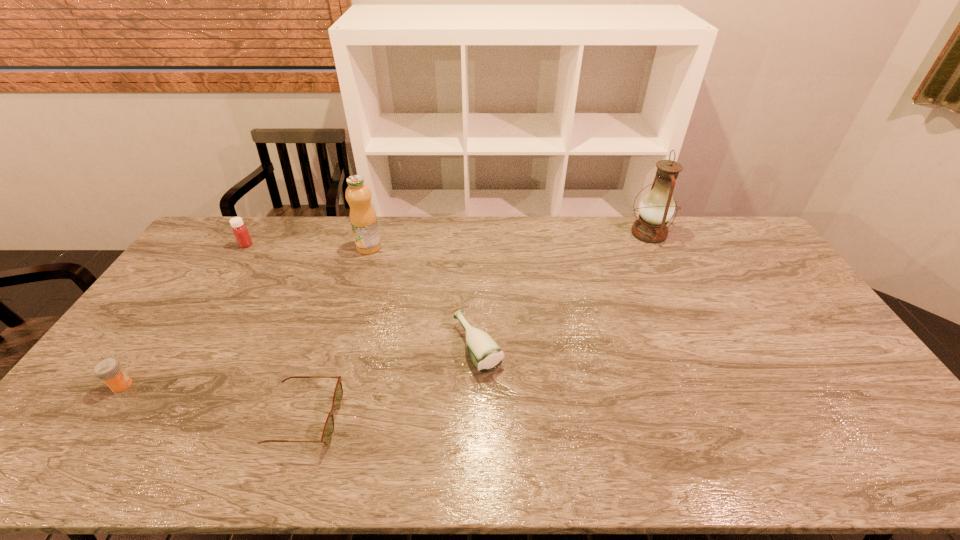
Where is `empty location between the shortest object and the tallest object`? This screenshot has height=540, width=960. empty location between the shortest object and the tallest object is located at coordinates (477, 326).

This screenshot has height=540, width=960. I want to click on free space between the shortest object and the tallest object, so click(477, 326).

You are a GUI agent. You are given a task and a screenshot of the screen. Output one action in this format:
    pyautogui.click(x=<x>, y=<y>)
    Task: Click on the free space between the oil lamp and the shorter medicine
    The image size is (960, 540).
    Given the screenshot: What is the action you would take?
    pyautogui.click(x=385, y=309)

Where is `vacant area that lies between the bottle and the rightmost object`? This screenshot has height=540, width=960. vacant area that lies between the bottle and the rightmost object is located at coordinates 564,290.

You are a GUI agent. You are given a task and a screenshot of the screen. Output one action in this format:
    pyautogui.click(x=<x>, y=<y>)
    Task: Click on the empty space that is in between the tallest object and the fifth shortest object
    The image size is (960, 540).
    Given the screenshot: What is the action you would take?
    pyautogui.click(x=509, y=240)

Find the location of a particular element. The width and height of the screenshot is (960, 540). free space that is in between the nearer medicine and the bottle is located at coordinates (300, 366).

Point out which object is positioned as the third nearest to the spectacles. Please provide its 2D coordinates. Your answer should be formatted as a tuple, i.e. [(x, y)], where the tuple contains the x and y coordinates of a point satisfying the conditions above.

[(363, 220)]

Locate an element on the screen. the second closest object to the fourth shortest object is located at coordinates (109, 370).

The width and height of the screenshot is (960, 540). In order to click on free point that satisfies the following two spatial constraints: 1. on the front label of the bottle; 2. on the right side of the second tallest object in this screenshot , I will do `click(339, 346)`.

Where is `blank space that satisfies the following two spatial constraints: 1. on the front label of the fruit juice; 2. at the front view of the spectacles`? Image resolution: width=960 pixels, height=540 pixels. blank space that satisfies the following two spatial constraints: 1. on the front label of the fruit juice; 2. at the front view of the spectacles is located at coordinates (318, 420).